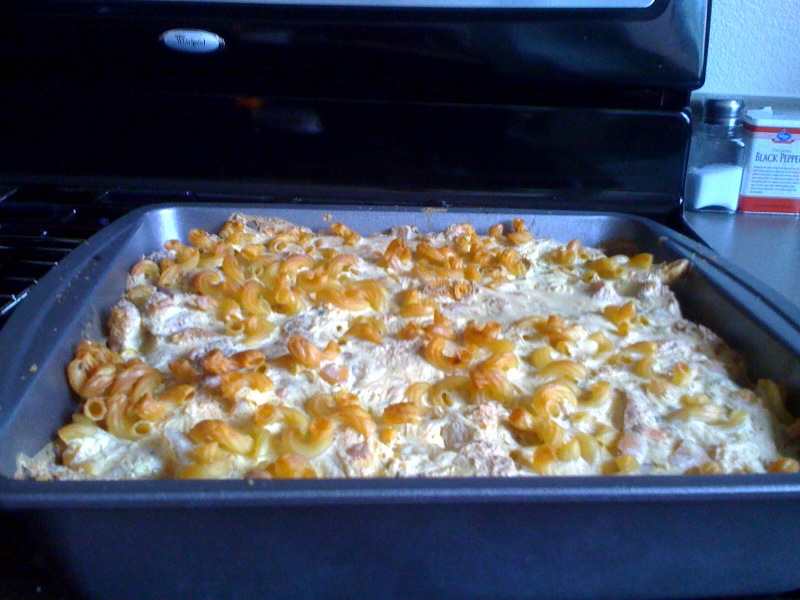
You are a GUI agent. You are given a task and a screenshot of the screen. Output one action in this format:
    pyautogui.click(x=<x>, y=<y>)
    Task: Click on the back of stove
    The height and width of the screenshot is (600, 800).
    Given the screenshot: What is the action you would take?
    (x=74, y=121), (x=337, y=127), (x=570, y=134)